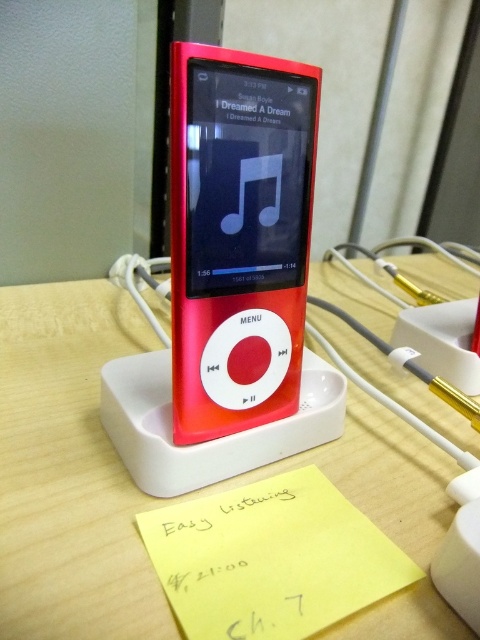
Question: Is the position of matte plastic table at center more distant than that of matte plastic ipod at center?

Choices:
 (A) yes
 (B) no

Answer: (B)

Question: Which object is farther from the camera taking this photo?

Choices:
 (A) matte plastic ipod at center
 (B) matte plastic table at center
 (C) yellow paper at lower center

Answer: (A)

Question: Observing the image, what is the correct spatial positioning of matte plastic table at center in reference to yellow paper at lower center?

Choices:
 (A) below
 (B) above

Answer: (B)

Question: Is matte plastic ipod at center in front of yellow paper at lower center?

Choices:
 (A) no
 (B) yes

Answer: (A)

Question: Which point is farther to the camera?

Choices:
 (A) (287, 214)
 (B) (43, 356)

Answer: (B)

Question: Which object is the farthest from the matte plastic table at center?

Choices:
 (A) yellow paper at lower center
 (B) matte plastic ipod at center

Answer: (B)